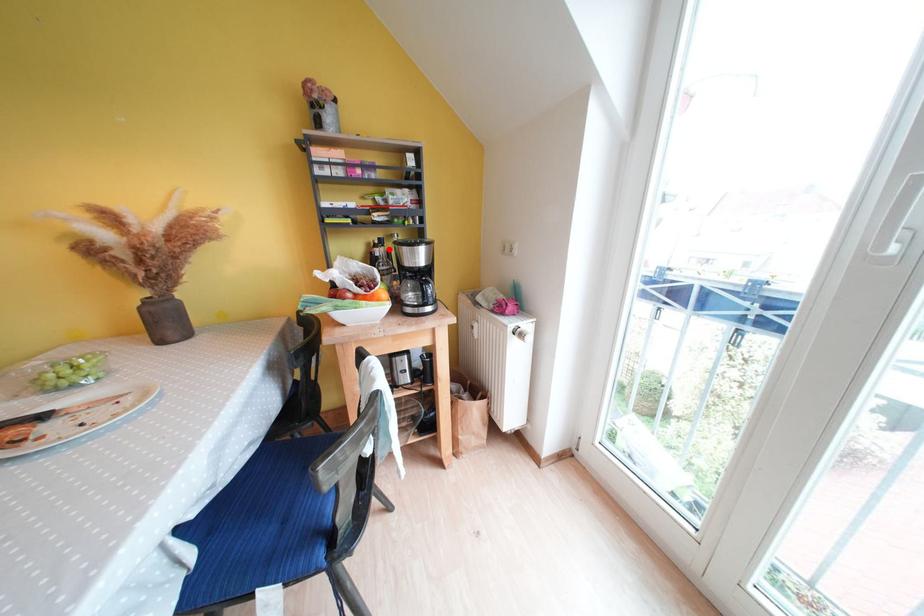
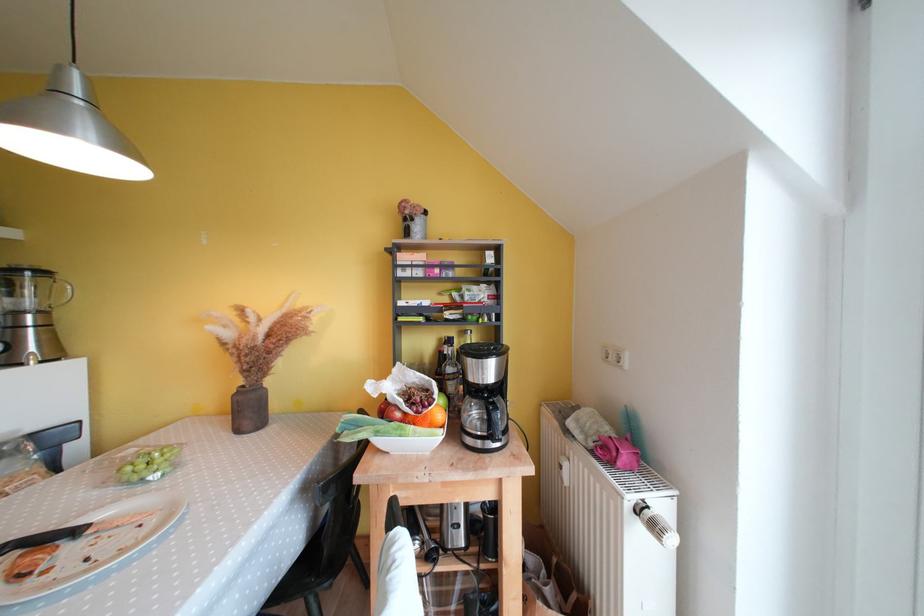
Find the pixel in the second image that matches the highlighted location in the first image.

(457, 350)